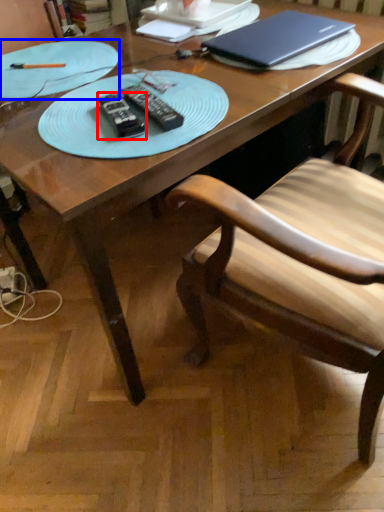
Question: Which object is further to the camera taking this photo, remote (highlighted by a red box) or plate (highlighted by a blue box)?

Choices:
 (A) remote
 (B) plate

Answer: (B)